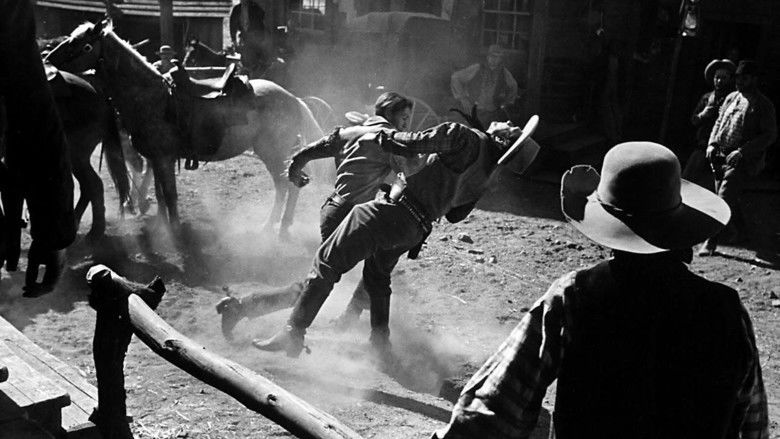
Find the location of a particular element. window is located at coordinates (x=509, y=38), (x=305, y=9).